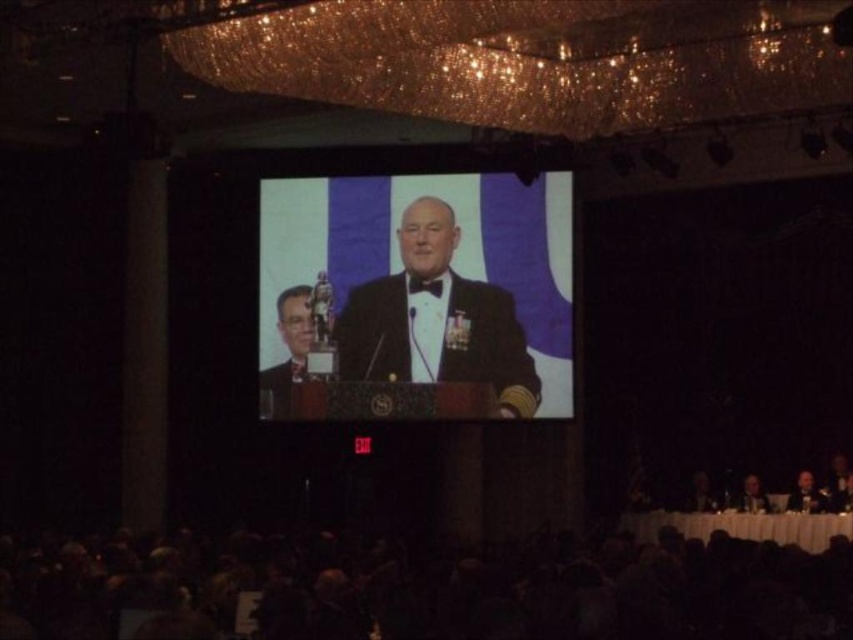
Can you confirm if satin black suit at center is bigger than smooth skin face at lower right?

Indeed, satin black suit at center has a larger size compared to smooth skin face at lower right.

Describe the element at coordinates (436, 321) in the screenshot. This screenshot has width=853, height=640. I see `satin black suit at center` at that location.

The image size is (853, 640). What are the coordinates of `satin black suit at center` in the screenshot? It's located at (436, 321).

Image resolution: width=853 pixels, height=640 pixels. Find the location of `satin black suit at center`. satin black suit at center is located at coordinates (436, 321).

From the picture: Does satin black suit at center appear over dark suit at lower right?

Correct, satin black suit at center is located above dark suit at lower right.

Does satin black suit at center have a lesser height compared to dark suit at lower right?

In fact, satin black suit at center may be taller than dark suit at lower right.

Does point (402, 317) come in front of point (801, 506)?

That is False.

Where is `satin black suit at center`? The height and width of the screenshot is (640, 853). satin black suit at center is located at coordinates (436, 321).

Which is more to the right, matte black suit at center or smooth skin face at lower right?

smooth skin face at lower right

Image resolution: width=853 pixels, height=640 pixels. I want to click on matte black suit at center, so coord(293,342).